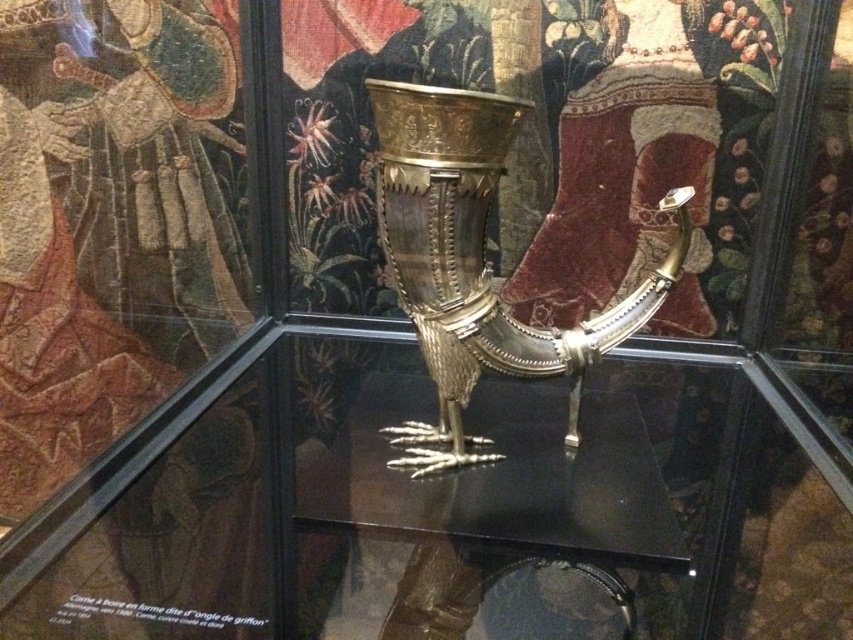
Question: Is transparent glass table at center below gold metallic goblet at center?

Choices:
 (A) yes
 (B) no

Answer: (A)

Question: Is transparent glass table at center bigger than gold metallic goblet at center?

Choices:
 (A) yes
 (B) no

Answer: (A)

Question: Which point appears farthest from the camera in this image?

Choices:
 (A) 457,269
 (B) 601,488

Answer: (B)

Question: Can you confirm if transparent glass table at center is thinner than gold metallic goblet at center?

Choices:
 (A) yes
 (B) no

Answer: (B)